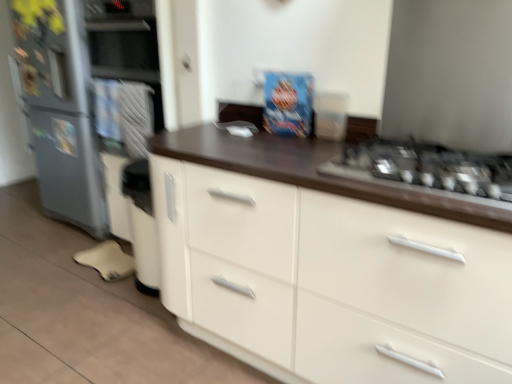
Question: Considering the relative sizes of white glossy cabinet at center and metallic gray refrigerator at left in the image provided, is white glossy cabinet at center taller than metallic gray refrigerator at left?

Choices:
 (A) yes
 (B) no

Answer: (B)

Question: Would you consider white glossy cabinet at center to be distant from metallic gray refrigerator at left?

Choices:
 (A) yes
 (B) no

Answer: (A)

Question: Does white glossy cabinet at center have a greater width compared to metallic gray refrigerator at left?

Choices:
 (A) yes
 (B) no

Answer: (A)

Question: From the image's perspective, does white glossy cabinet at center appear lower than metallic gray refrigerator at left?

Choices:
 (A) yes
 (B) no

Answer: (A)

Question: Does white glossy cabinet at center appear on the left side of metallic gray refrigerator at left?

Choices:
 (A) yes
 (B) no

Answer: (B)

Question: From a real-world perspective, is white glossy cabinet at center positioned under metallic gray refrigerator at left based on gravity?

Choices:
 (A) no
 (B) yes

Answer: (B)

Question: Does metallic silver gas stove at right turn towards white glossy cabinet at center?

Choices:
 (A) no
 (B) yes

Answer: (B)

Question: Considering the relative sizes of metallic silver gas stove at right and white glossy cabinet at center in the image provided, is metallic silver gas stove at right wider than white glossy cabinet at center?

Choices:
 (A) yes
 (B) no

Answer: (B)

Question: Is metallic silver gas stove at right positioned far away from white glossy cabinet at center?

Choices:
 (A) no
 (B) yes

Answer: (A)

Question: From the image's perspective, is metallic silver gas stove at right over white glossy cabinet at center?

Choices:
 (A) no
 (B) yes

Answer: (B)

Question: Would you say metallic silver gas stove at right is outside white glossy cabinet at center?

Choices:
 (A) yes
 (B) no

Answer: (B)

Question: Is metallic silver gas stove at right to the right of white glossy cabinet at center from the viewer's perspective?

Choices:
 (A) yes
 (B) no

Answer: (A)

Question: From the image's perspective, does metallic silver gas stove at right appear lower than metallic gray refrigerator at left?

Choices:
 (A) no
 (B) yes

Answer: (B)